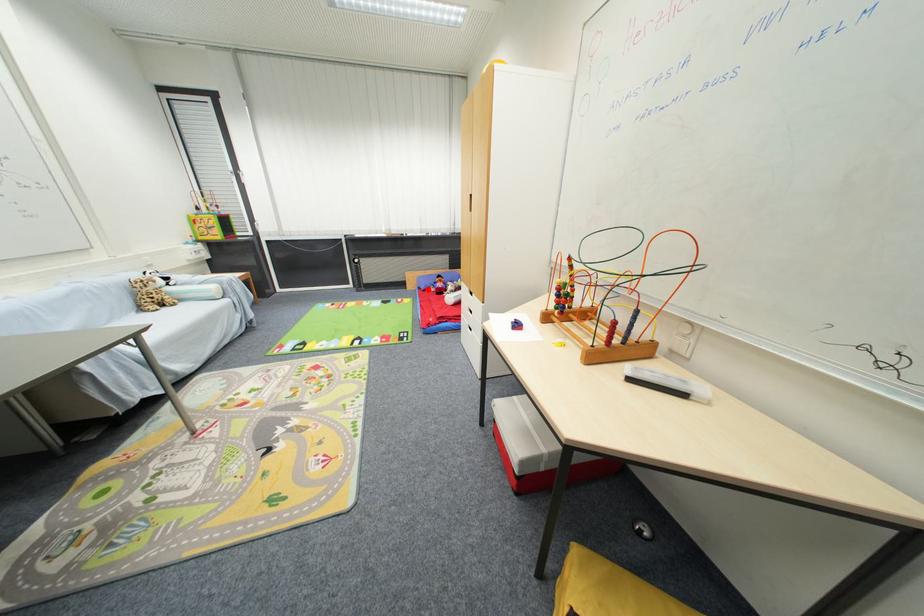
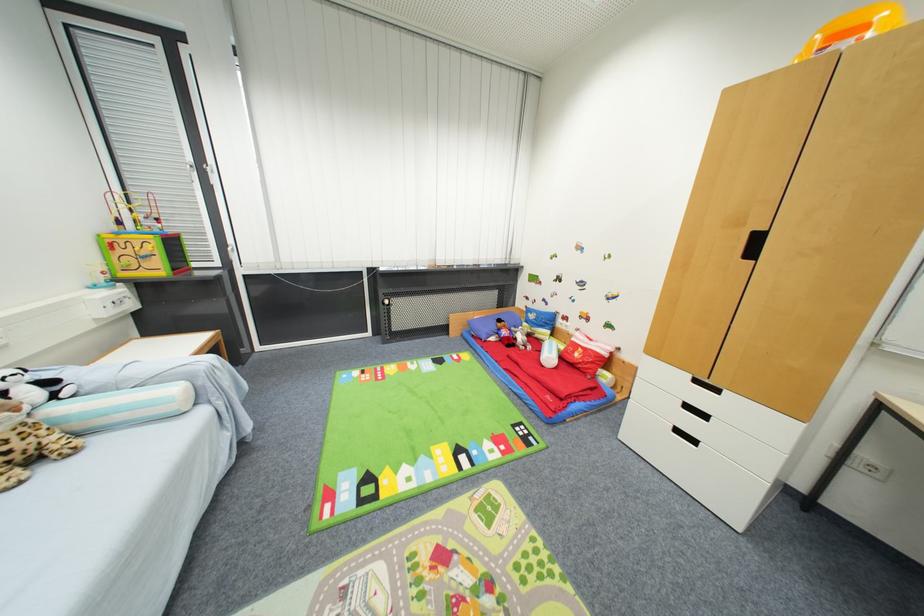
Question: I am providing you with two images of the same scene from different viewpoints. Given a red point in image1, look at the same physical point in image2. Is it:

Choices:
 (A) Closer to the viewpoint
 (B) Farther from the viewpoint

Answer: (B)